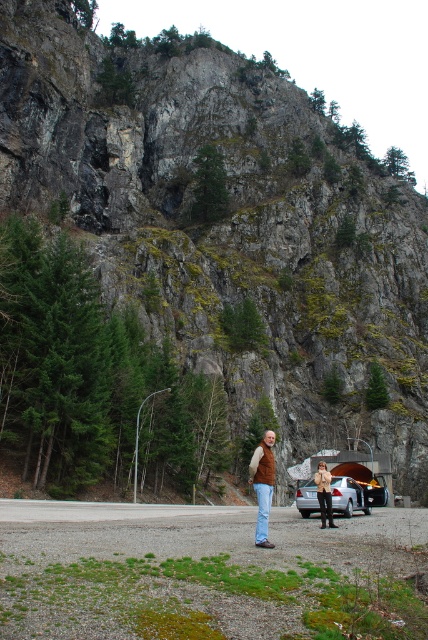
Question: Which object is farther from the camera taking this photo?

Choices:
 (A) brown suede jacket at center
 (B) brown suede vest at center

Answer: (A)

Question: In this image, where is brown suede vest at center located relative to satin silver sedan at center?

Choices:
 (A) left
 (B) right

Answer: (A)

Question: Does brown suede vest at center come in front of satin silver sedan at center?

Choices:
 (A) no
 (B) yes

Answer: (B)

Question: Is satin silver sedan at center smaller than brown suede jacket at center?

Choices:
 (A) yes
 (B) no

Answer: (B)

Question: Which point is farther from the camera taking this photo?

Choices:
 (A) (302, 506)
 (B) (383, 486)

Answer: (B)

Question: Which point is farther to the camera?

Choices:
 (A) metallic silver baby carriage at center
 (B) satin silver sedan at center

Answer: (A)